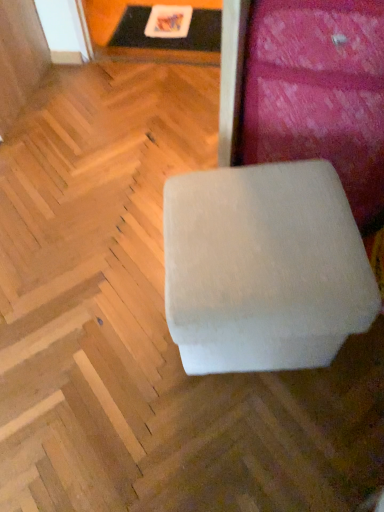
Question: Which direction should I rotate to look at white fabric ottoman at center, which appears as the 2th furniture when viewed from the top?

Choices:
 (A) right
 (B) left

Answer: (A)

Question: From a real-world perspective, is white fabric ottoman at center, acting as the second furniture starting from the bottom, under white fabric ottoman at center, which appears as the 2th furniture when viewed from the top?

Choices:
 (A) no
 (B) yes

Answer: (A)

Question: Would you say white fabric ottoman at center, acting as the second furniture starting from the bottom, is a long distance from white fabric ottoman at center, which appears as the 1th furniture when ordered from the bottom?

Choices:
 (A) no
 (B) yes

Answer: (A)

Question: Does white fabric ottoman at center, acting as the second furniture starting from the bottom, appear on the right side of white fabric ottoman at center, which appears as the 2th furniture when viewed from the top?

Choices:
 (A) no
 (B) yes

Answer: (B)

Question: Is white fabric ottoman at center, acting as the second furniture starting from the bottom, positioned before white fabric ottoman at center, which appears as the 1th furniture when ordered from the bottom?

Choices:
 (A) no
 (B) yes

Answer: (A)

Question: Is white fabric ottoman at center, acting as the second furniture starting from the bottom, to the left of white fabric ottoman at center, which appears as the 1th furniture when ordered from the bottom, from the viewer's perspective?

Choices:
 (A) no
 (B) yes

Answer: (A)

Question: Can you confirm if white fabric ottoman at center, arranged as the first furniture when viewed from the top, is taller than white fabric ottoman at center, which appears as the 2th furniture when viewed from the top?

Choices:
 (A) no
 (B) yes

Answer: (B)

Question: Is white plastic tray at upper center completely or partially outside of white fabric ottoman at center, acting as the second furniture starting from the bottom?

Choices:
 (A) no
 (B) yes

Answer: (B)

Question: From a real-world perspective, is white plastic tray at upper center located beneath white fabric ottoman at center, acting as the second furniture starting from the bottom?

Choices:
 (A) yes
 (B) no

Answer: (A)

Question: Are white plastic tray at upper center and white fabric ottoman at center, acting as the second furniture starting from the bottom, beside each other?

Choices:
 (A) no
 (B) yes

Answer: (A)

Question: Is white plastic tray at upper center to the right of white fabric ottoman at center, acting as the second furniture starting from the bottom, from the viewer's perspective?

Choices:
 (A) no
 (B) yes

Answer: (A)

Question: Can you confirm if white plastic tray at upper center is bigger than white fabric ottoman at center, arranged as the first furniture when viewed from the top?

Choices:
 (A) no
 (B) yes

Answer: (A)

Question: Does white plastic tray at upper center lie in front of white fabric ottoman at center, arranged as the first furniture when viewed from the top?

Choices:
 (A) yes
 (B) no

Answer: (B)

Question: Does white fabric ottoman at center, acting as the second furniture starting from the bottom, appear on the right side of white plastic tray at upper center?

Choices:
 (A) no
 (B) yes

Answer: (B)